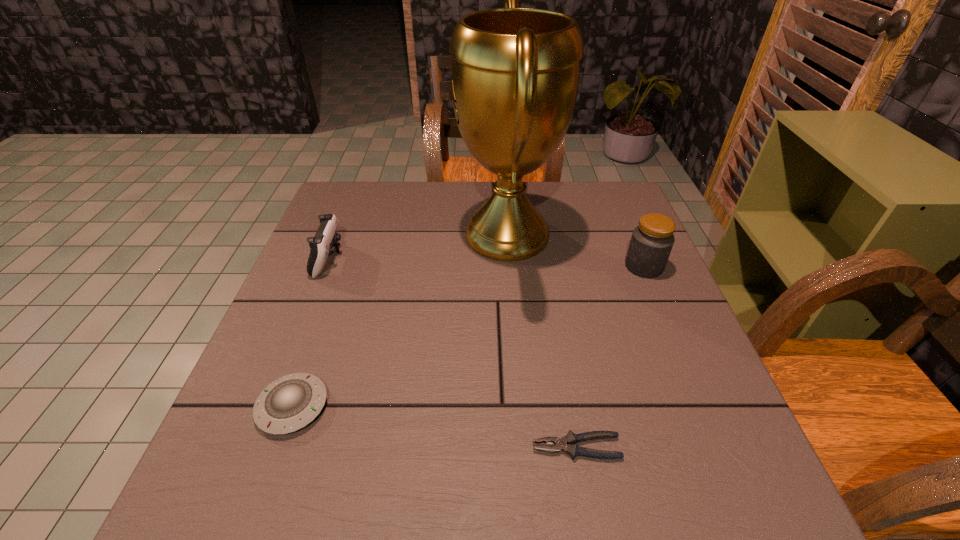
The image size is (960, 540). Identify the location of saucer present at the left edge. (291, 402).

In order to click on object that is at the right edge in this screenshot , I will do `click(651, 243)`.

I want to click on vacant region at the far edge of the desktop, so click(x=393, y=200).

The image size is (960, 540). In the image, there is a desktop. Identify the location of blank space at the near edge. (359, 515).

The width and height of the screenshot is (960, 540). In the image, there is a desktop. Identify the location of vacant space at the left edge. (353, 233).

Locate an element on the screen. free space at the right edge of the desktop is located at coordinates (732, 442).

The height and width of the screenshot is (540, 960). In order to click on vacant space at the far left corner in this screenshot , I will do `click(360, 188)`.

Image resolution: width=960 pixels, height=540 pixels. In the image, there is a desktop. Identify the location of free region at the far right corner. (590, 215).

You are a GUI agent. You are given a task and a screenshot of the screen. Output one action in this format:
    pyautogui.click(x=<x>, y=<y>)
    Task: Click on the empty location between the control and the second shortest object
    Image resolution: width=960 pixels, height=540 pixels.
    Given the screenshot: What is the action you would take?
    pyautogui.click(x=311, y=333)

Find the location of a particular element. Image resolution: width=960 pixels, height=540 pixels. vacant area that lies between the rightmost object and the saucer is located at coordinates (468, 336).